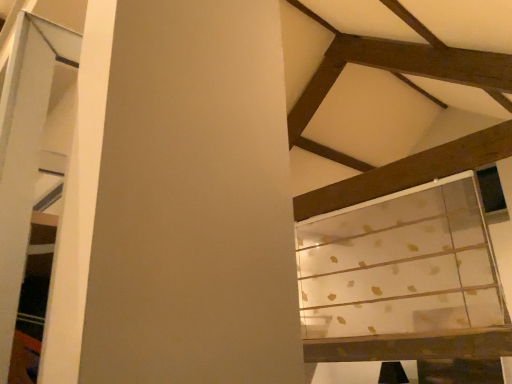
This screenshot has width=512, height=384. What do you see at coordinates (402, 279) in the screenshot?
I see `transparent glass box at upper right` at bounding box center [402, 279].

The height and width of the screenshot is (384, 512). I want to click on transparent glass box at upper right, so click(402, 279).

I want to click on transparent glass box at upper right, so click(402, 279).